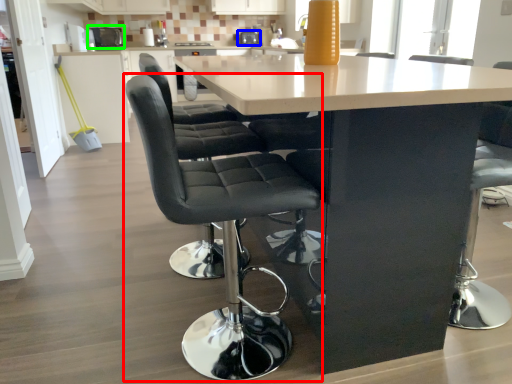
Question: Based on their relative distances, which object is farther from chair (highlighted by a red box)? Choose from appliance (highlighted by a blue box) and appliance (highlighted by a green box).

Choices:
 (A) appliance
 (B) appliance

Answer: (B)